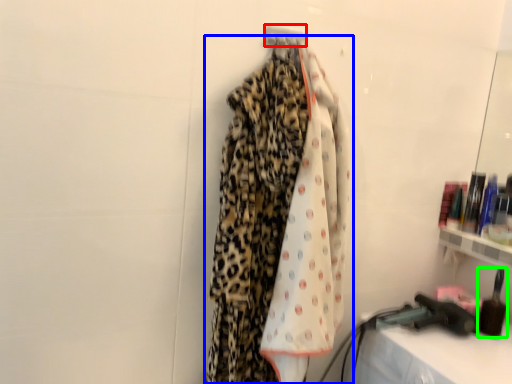
Question: Based on their relative distances, which object is nearer to hanger (highlighted by a red box)? Choose from curtain (highlighted by a blue box) and toiletry (highlighted by a green box).

Choices:
 (A) curtain
 (B) toiletry

Answer: (A)